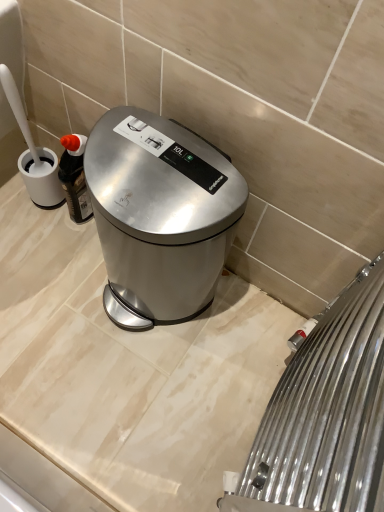
Locate an element on the screen. The image size is (384, 512). vacant space situated above satin silver trash can at center (from a real-world perspective) is located at coordinates (155, 166).